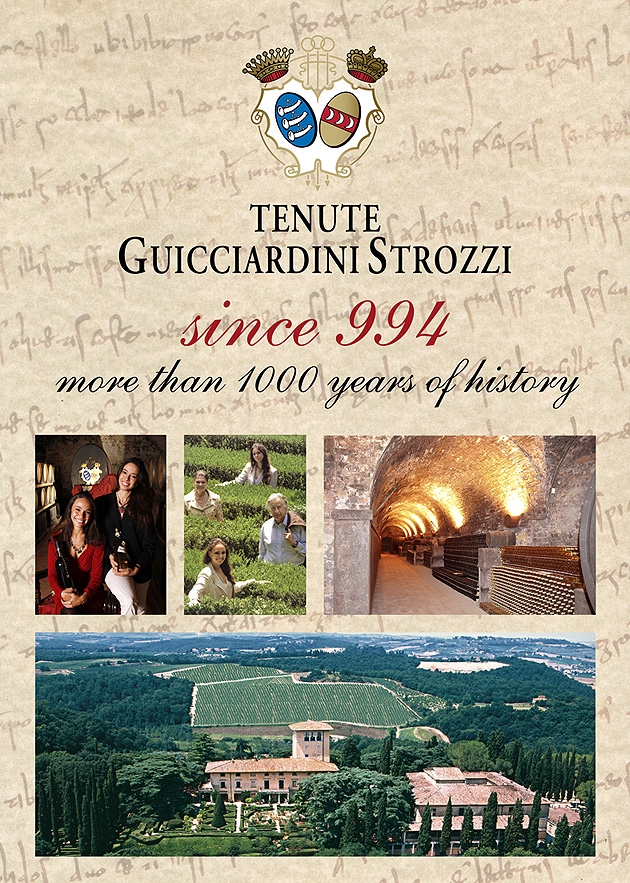
You are a GUI agent. You are given a task and a screenshot of the screen. Output one action in this format:
    pyautogui.click(x=<x>, y=<y>)
    Task: Click on the red chair
    This screenshot has width=630, height=883.
    Given the screenshot: What is the action you would take?
    pyautogui.click(x=105, y=488)